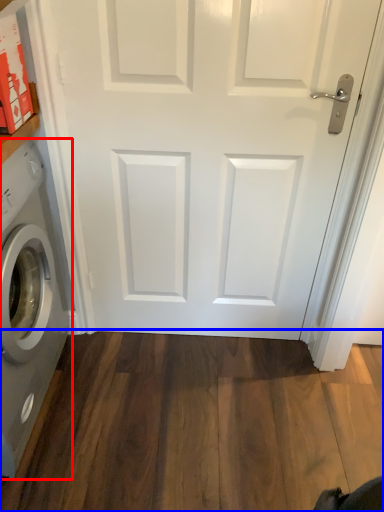
Question: Among these objects, which one is farthest to the camera, washing machine (highlighted by a red box) or hardwood (highlighted by a blue box)?

Choices:
 (A) washing machine
 (B) hardwood

Answer: (B)